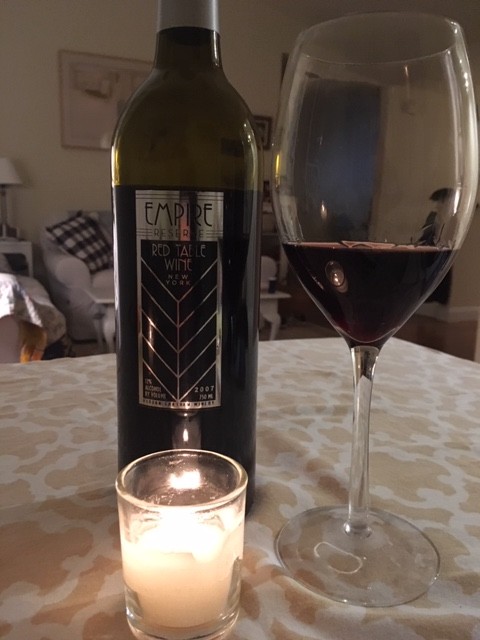
At what (x,y) coordinates should I click in order to perform the action: click on pillow. Please return your answer as a coordinate pair (x, y). Looking at the image, I should click on (85, 240).